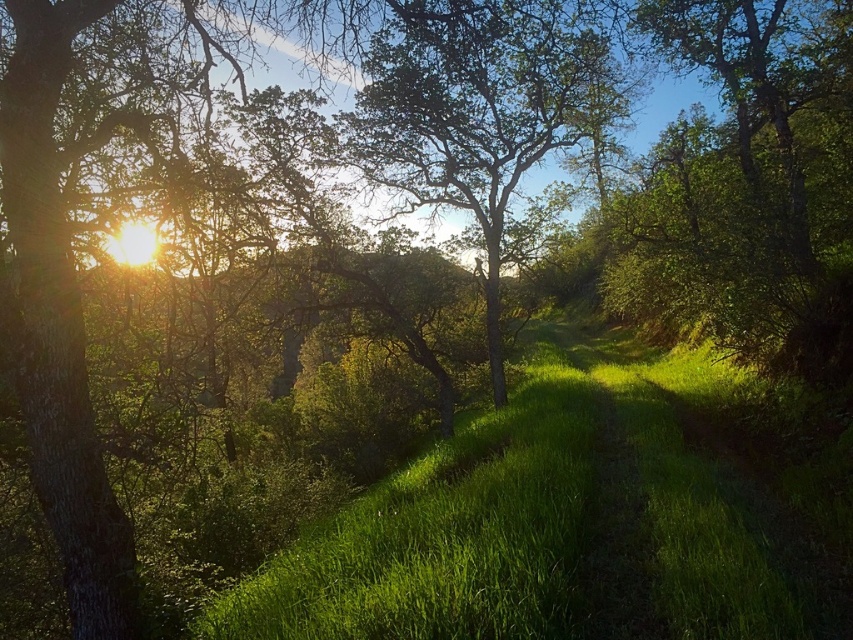
You are standing at the starting point of the green grassy path at center in the forest. There is a point marked at coordinates point (581,516). Is this point located on the green grassy path at center?

Yes, the point (581,516) is on the green grassy path at center according to the description.

You are standing at the edge of the forest and see the green grassy path at center and the green leafy tree at center. Which one is shorter?

The green grassy path at center is shorter than the green leafy tree at center.